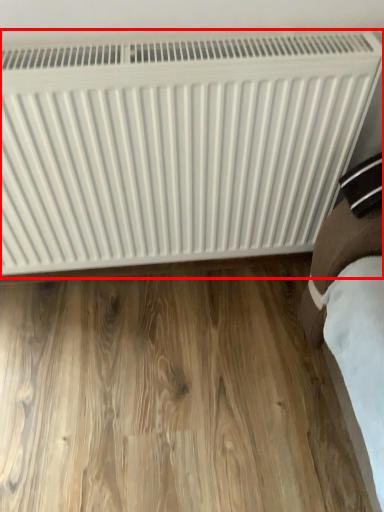
Question: From the image, what is the correct spatial relationship of radiator (annotated by the red box) in relation to hardwood?

Choices:
 (A) right
 (B) left

Answer: (A)